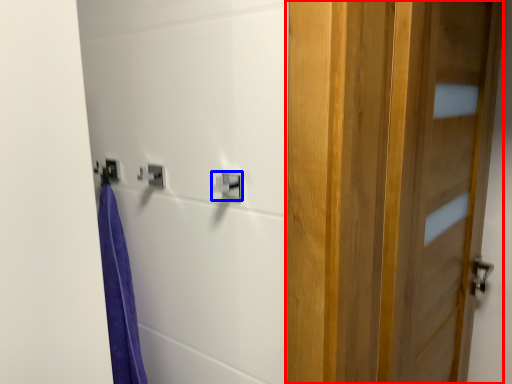
Question: Which point is closer to the camera, door (highlighted by a red box) or lock (highlighted by a blue box)?

Choices:
 (A) door
 (B) lock

Answer: (A)